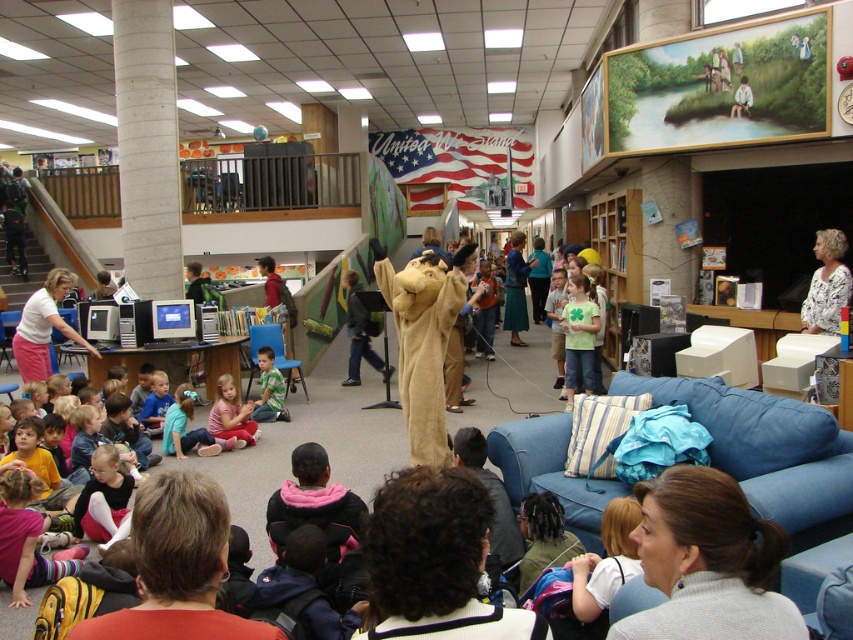
Is pink fabric pants at lower center above green matte shirt at lower center?

Incorrect, pink fabric pants at lower center is not positioned above green matte shirt at lower center.

Is point (225, 372) farther from viewer compared to point (274, 380)?

Yes, it is behind point (274, 380).

The image size is (853, 640). I want to click on pink fabric pants at lower center, so click(x=231, y=413).

Find the location of `pink fabric pants at lower center`. pink fabric pants at lower center is located at coordinates (231, 413).